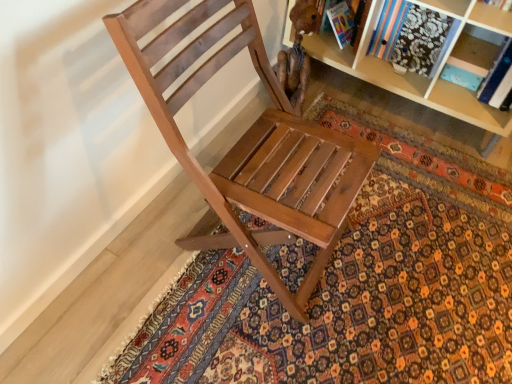
This screenshot has height=384, width=512. I want to click on free region under patterned carpet at center (from a real-world perspective), so click(390, 268).